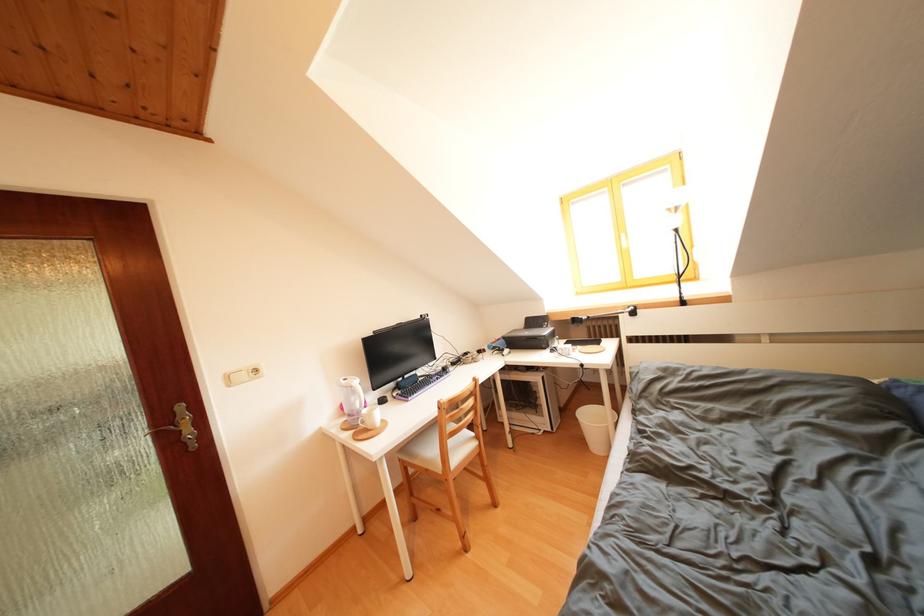
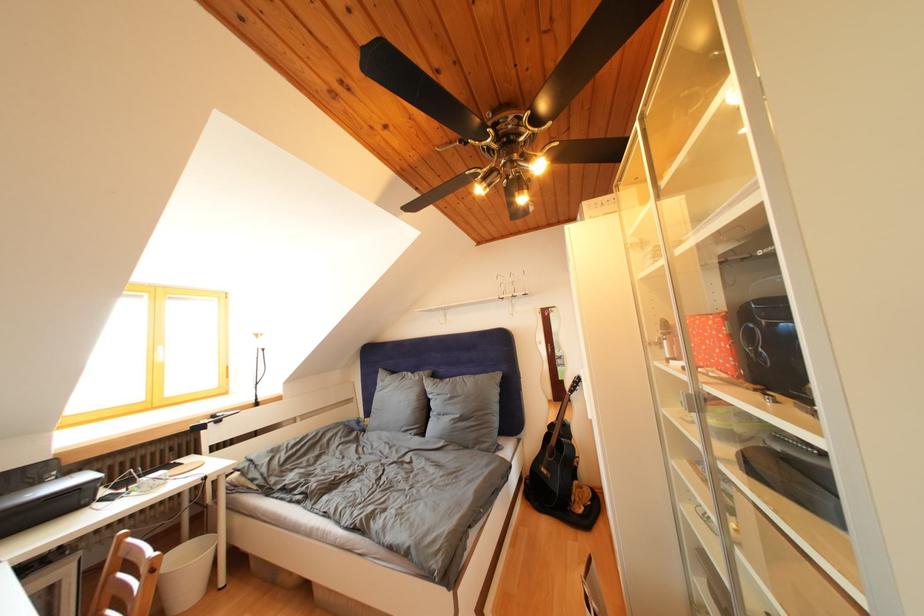
The point at (549,331) is marked in the first image. Where is the corresponding point in the second image?

(44, 488)